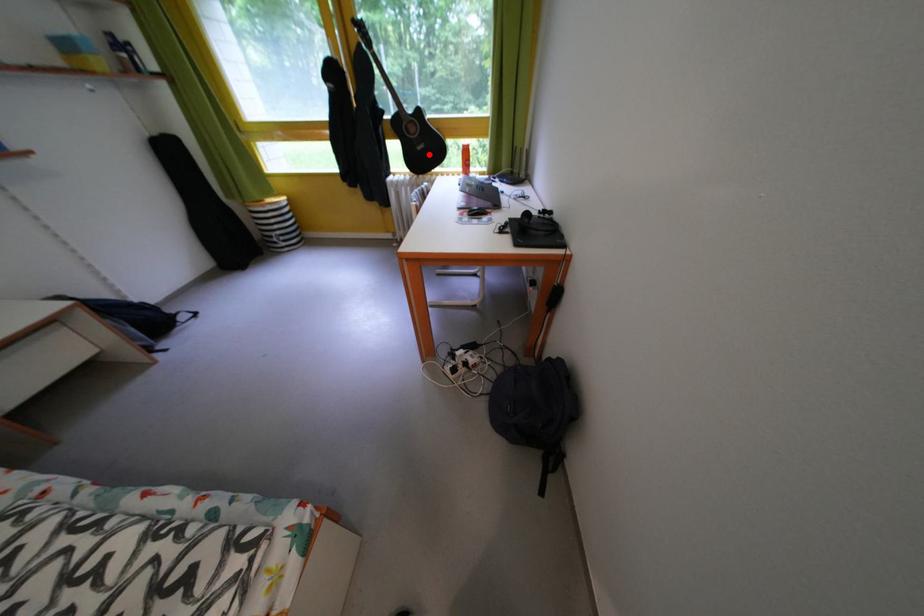
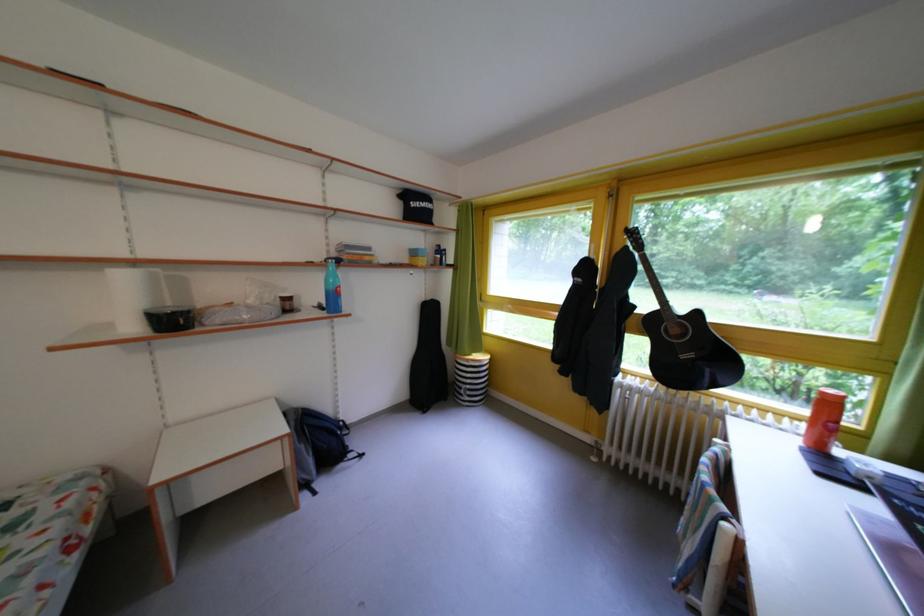
Question: I am providing you with two images of the same scene from different viewpoints. In image1, a red point is highlighted. Considering the same 3D point in image2, which of the following is correct?

Choices:
 (A) It is closer
 (B) It is farther

Answer: (B)